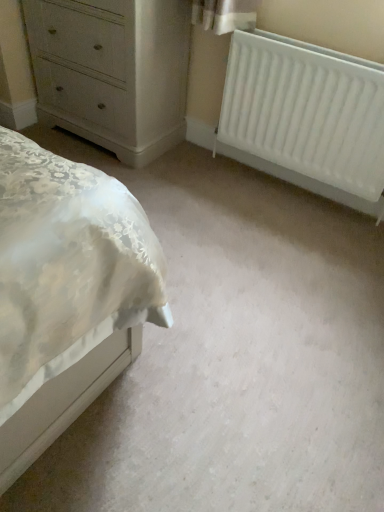
You are a GUI agent. You are given a task and a screenshot of the screen. Output one action in this format:
    pyautogui.click(x=<x>, y=<y>)
    Task: Click on the vacant space in between white painted wood chest of drawers at upper left and white matte radiator at right
    The height and width of the screenshot is (512, 384).
    Given the screenshot: What is the action you would take?
    pyautogui.click(x=232, y=182)